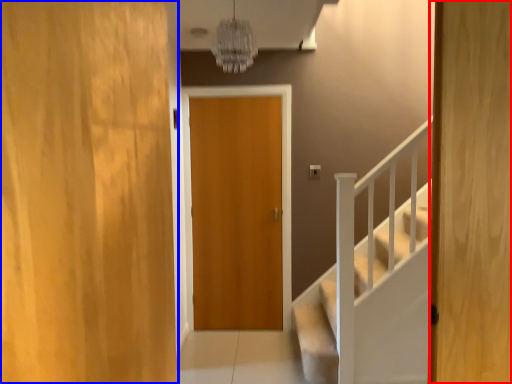
Question: Which object appears closest to the camera in this image, door (highlighted by a red box) or door (highlighted by a blue box)?

Choices:
 (A) door
 (B) door

Answer: (B)